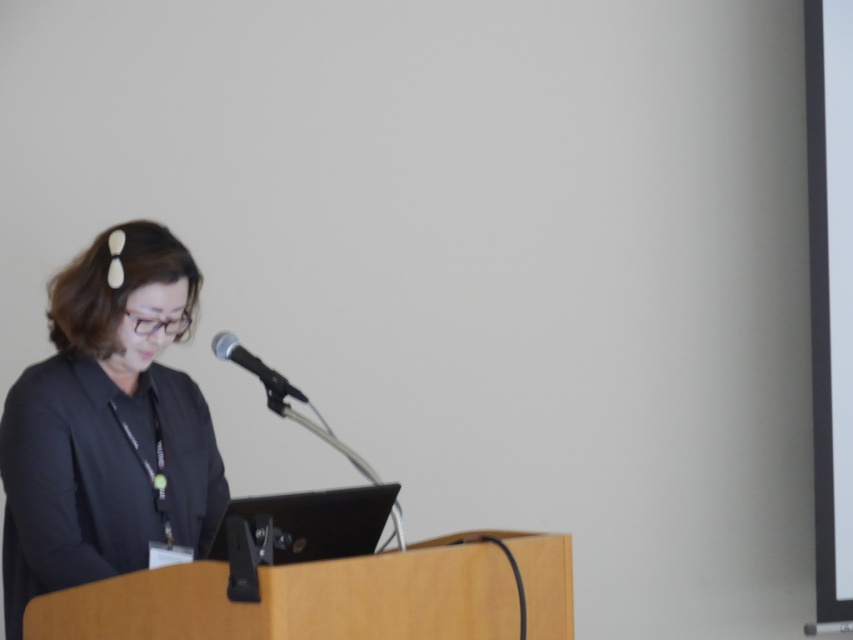
Can you confirm if black matte blazer at left is positioned to the right of black metallic microphone at center?

In fact, black matte blazer at left is to the left of black metallic microphone at center.

What do you see at coordinates (107, 424) in the screenshot? This screenshot has width=853, height=640. I see `black matte blazer at left` at bounding box center [107, 424].

Who is more forward, (35, 532) or (221, 333)?

Point (35, 532) is in front.

Locate an element on the screen. black matte blazer at left is located at coordinates (107, 424).